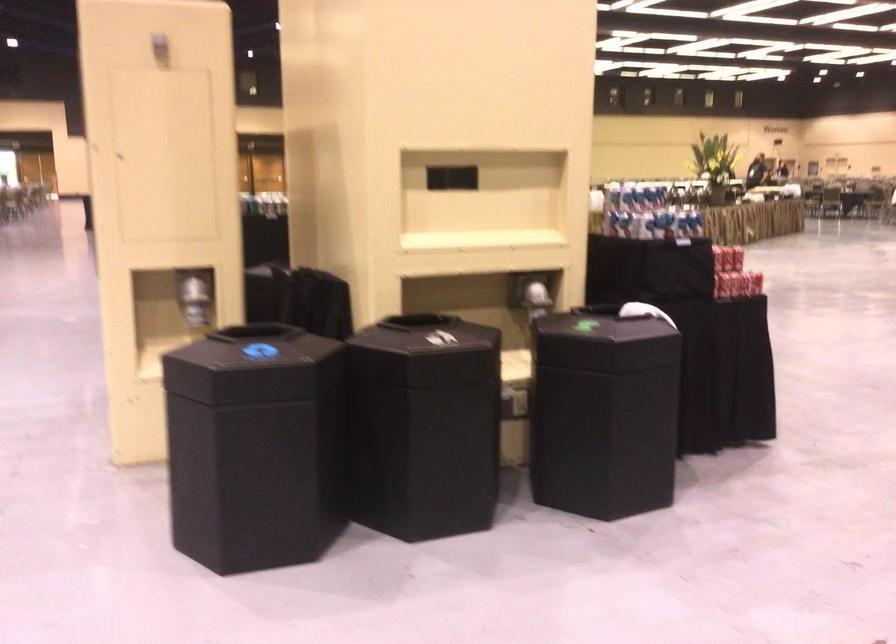
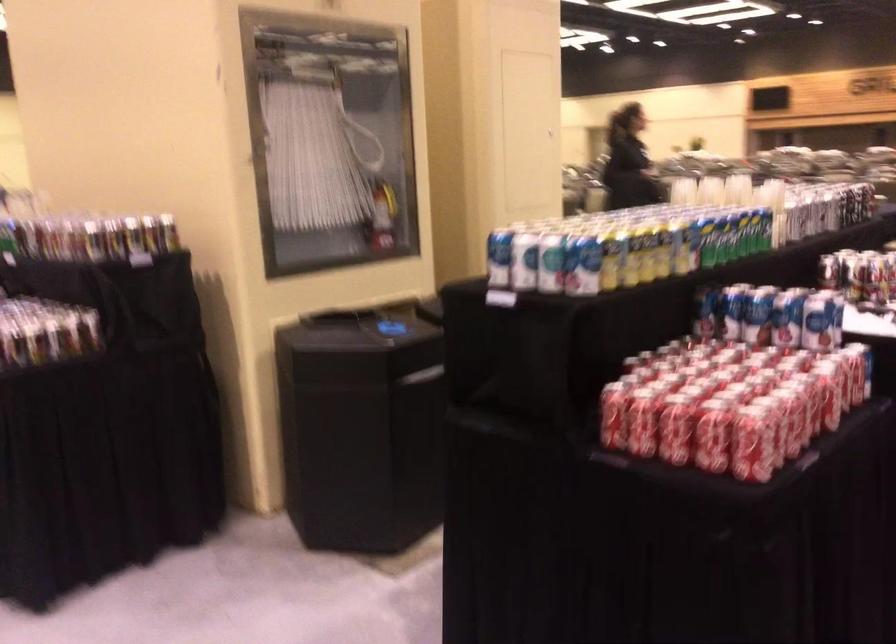
Question: I am providing you with two images of the same scene from different viewpoints. Please identify which objects are invisible in image2.

Choices:
 (A) red soda can
 (B) cream-colored curtain
 (C) red fire extinguisher
 (D) black bin lid

Answer: (D)